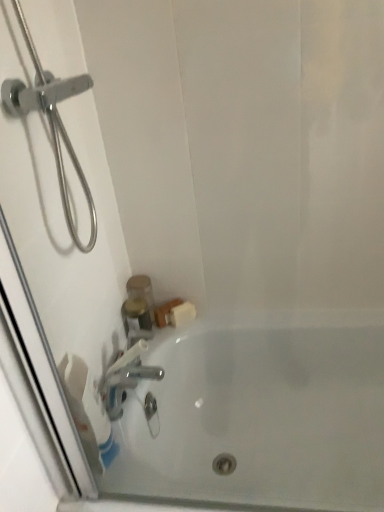
Locate an element on the screen. The image size is (384, 512). white glossy bathtub at lower center is located at coordinates (261, 414).

You are a GUI agent. You are given a task and a screenshot of the screen. Output one action in this format:
    pyautogui.click(x=<x>, y=<y>)
    Task: Click on the translucent plastic container at upper left
    The height and width of the screenshot is (512, 384).
    Given the screenshot: What is the action you would take?
    pyautogui.click(x=142, y=291)

Where is `white matte toilet paper at lower left`? white matte toilet paper at lower left is located at coordinates (87, 409).

From a real-world perspective, which is physically below, silver metallic faucet at lower left or white glossy bathtub at lower center?

white glossy bathtub at lower center, from a real-world perspective.

Considering the relative sizes of silver metallic faucet at lower left and white glossy bathtub at lower center in the image provided, is silver metallic faucet at lower left smaller than white glossy bathtub at lower center?

Correct, silver metallic faucet at lower left occupies less space than white glossy bathtub at lower center.

At what (x,y) coordinates should I click in order to perform the action: click on bathtub below the silver metallic faucet at lower left (from the image's perspective). Please return your answer as a coordinate pair (x, y). Looking at the image, I should click on (261, 414).

Measure the distance from silver metallic faucet at lower left to white glossy bathtub at lower center.

They are 11.13 inches apart.

Based on their sizes in the image, would you say translucent plastic container at upper left is bigger or smaller than silver metallic faucet at lower left?

Clearly, translucent plastic container at upper left is smaller in size than silver metallic faucet at lower left.

Could you measure the distance between translucent plastic container at upper left and silver metallic faucet at lower left?

translucent plastic container at upper left and silver metallic faucet at lower left are 5.52 inches apart.

From a real-world perspective, is translucent plastic container at upper left physically below silver metallic faucet at lower left?

Correct, in the physical world, translucent plastic container at upper left is lower than silver metallic faucet at lower left.

Does point (138, 288) come farther from viewer compared to point (113, 364)?

No.

Considering the relative sizes of white glossy bathtub at lower center and silver metallic faucet at lower left in the image provided, is white glossy bathtub at lower center bigger than silver metallic faucet at lower left?

Indeed, white glossy bathtub at lower center has a larger size compared to silver metallic faucet at lower left.

Does white glossy bathtub at lower center contain silver metallic faucet at lower left?

No.

Looking at this image, would you consider white glossy bathtub at lower center to be distant from silver metallic faucet at lower left?

They are positioned close to each other.

From the image's perspective, is white glossy bathtub at lower center under silver metallic faucet at lower left?

Yes, from the image's perspective, white glossy bathtub at lower center is beneath silver metallic faucet at lower left.

From a real-world perspective, who is located lower, white matte toilet paper at lower left or translucent plastic container at upper left?

In real-world perspective, translucent plastic container at upper left is lower.

Consider the image. In terms of width, does white matte toilet paper at lower left look wider or thinner when compared to translucent plastic container at upper left?

Clearly, white matte toilet paper at lower left has less width compared to translucent plastic container at upper left.

Can you confirm if white matte toilet paper at lower left is taller than translucent plastic container at upper left?

Yes, white matte toilet paper at lower left is taller than translucent plastic container at upper left.

From the picture: Is white matte toilet paper at lower left looking in the opposite direction of translucent plastic container at upper left?

white matte toilet paper at lower left is not turned away from translucent plastic container at upper left.

From the image's perspective, which one is positioned lower, translucent plastic container at upper left or white glossy bathtub at lower center?

white glossy bathtub at lower center.

The height and width of the screenshot is (512, 384). Find the location of `bathtub in front of the translucent plastic container at upper left`. bathtub in front of the translucent plastic container at upper left is located at coordinates (261, 414).

How many degrees apart are the facing directions of translucent plastic container at upper left and white glossy bathtub at lower center?

They differ by 88.6 degrees in their facing directions.

Is white matte toilet paper at lower left oriented towards silver metallic faucet at lower left?

No, white matte toilet paper at lower left is not aimed at silver metallic faucet at lower left.

Can you confirm if white matte toilet paper at lower left is thinner than silver metallic faucet at lower left?

Indeed, white matte toilet paper at lower left has a lesser width compared to silver metallic faucet at lower left.

Between white matte toilet paper at lower left and silver metallic faucet at lower left, which one is positioned in front?

white matte toilet paper at lower left is more forward.

Consider the image. Considering the sizes of objects white matte toilet paper at lower left and silver metallic faucet at lower left in the image provided, who is taller, white matte toilet paper at lower left or silver metallic faucet at lower left?

Standing taller between the two is white matte toilet paper at lower left.

Is the depth of white glossy bathtub at lower center greater than that of white matte toilet paper at lower left?

No, white glossy bathtub at lower center is closer to the camera.

How many degrees apart are the facing directions of white glossy bathtub at lower center and white matte toilet paper at lower left?

There is a 104-degree angle between the facing directions of white glossy bathtub at lower center and white matte toilet paper at lower left.

Is white matte toilet paper at lower left at the back of white glossy bathtub at lower center?

white glossy bathtub at lower center is not turned away from white matte toilet paper at lower left.

Considering the sizes of white glossy bathtub at lower center and white matte toilet paper at lower left in the image, is white glossy bathtub at lower center wider or thinner than white matte toilet paper at lower left?

Clearly, white glossy bathtub at lower center has more width compared to white matte toilet paper at lower left.

Where is `tap that appears above the white glossy bathtub at lower center (from the image's perspective)`? This screenshot has height=512, width=384. tap that appears above the white glossy bathtub at lower center (from the image's perspective) is located at coordinates (129, 357).

Find the location of a particular element. The image size is (384, 512). tap below the translucent plastic container at upper left (from the image's perspective) is located at coordinates (129, 357).

Looking at the image, which one is located closer to white matte toilet paper at lower left, white glossy bathtub at lower center or translucent plastic container at upper left?

Based on the image, translucent plastic container at upper left appears to be nearer to white matte toilet paper at lower left.

Consider the image. Based on their spatial positions, is translucent plastic container at upper left or silver metallic faucet at lower left further from white matte toilet paper at lower left?

translucent plastic container at upper left is further to white matte toilet paper at lower left.

From the image, which object appears to be nearer to white glossy bathtub at lower center, white matte toilet paper at lower left or translucent plastic container at upper left?

The object closer to white glossy bathtub at lower center is white matte toilet paper at lower left.

When comparing their distances from translucent plastic container at upper left, does white matte toilet paper at lower left or white glossy bathtub at lower center seem further?

white glossy bathtub at lower center.

Which object lies further to the anchor point silver metallic faucet at lower left, white matte toilet paper at lower left or translucent plastic container at upper left?

white matte toilet paper at lower left lies further to silver metallic faucet at lower left than the other object.

Looking at the image, which one is located further to silver metallic faucet at lower left, white glossy bathtub at lower center or white matte toilet paper at lower left?

white glossy bathtub at lower center lies further to silver metallic faucet at lower left than the other object.

Considering their positions, is translucent plastic container at upper left positioned closer to white glossy bathtub at lower center than white matte toilet paper at lower left?

The object closer to white glossy bathtub at lower center is white matte toilet paper at lower left.

From the image, which object appears to be nearer to white matte toilet paper at lower left, silver metallic faucet at lower left or white glossy bathtub at lower center?

Based on the image, silver metallic faucet at lower left appears to be nearer to white matte toilet paper at lower left.

Where is `tap between white glossy bathtub at lower center and translucent plastic container at upper left in the front-back direction`? The width and height of the screenshot is (384, 512). tap between white glossy bathtub at lower center and translucent plastic container at upper left in the front-back direction is located at coordinates (129, 357).

Locate an element on the screen. The height and width of the screenshot is (512, 384). tap between white matte toilet paper at lower left and translucent plastic container at upper left from front to back is located at coordinates (129, 357).

This screenshot has width=384, height=512. Identify the location of tap between white matte toilet paper at lower left and white glossy bathtub at lower center. (129, 357).

The height and width of the screenshot is (512, 384). Find the location of `toilet paper between white glossy bathtub at lower center and translucent plastic container at upper left from front to back`. toilet paper between white glossy bathtub at lower center and translucent plastic container at upper left from front to back is located at coordinates (87, 409).